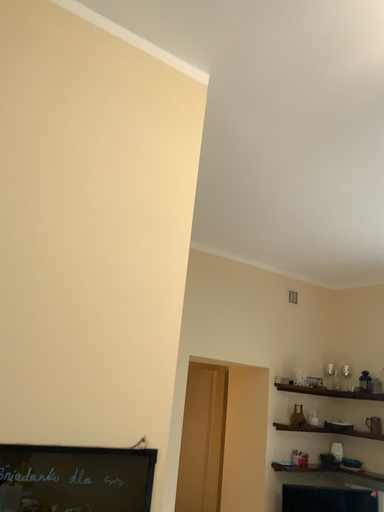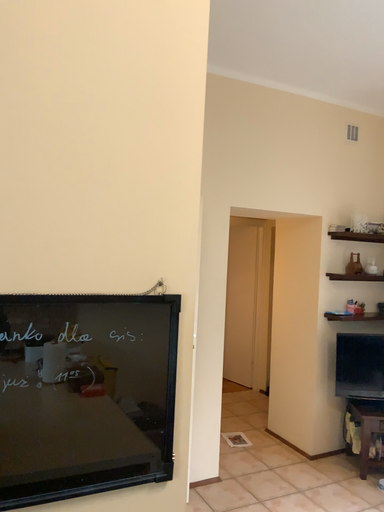
Question: How did the camera likely rotate when shooting the video?

Choices:
 (A) rotated downward
 (B) rotated upward

Answer: (A)